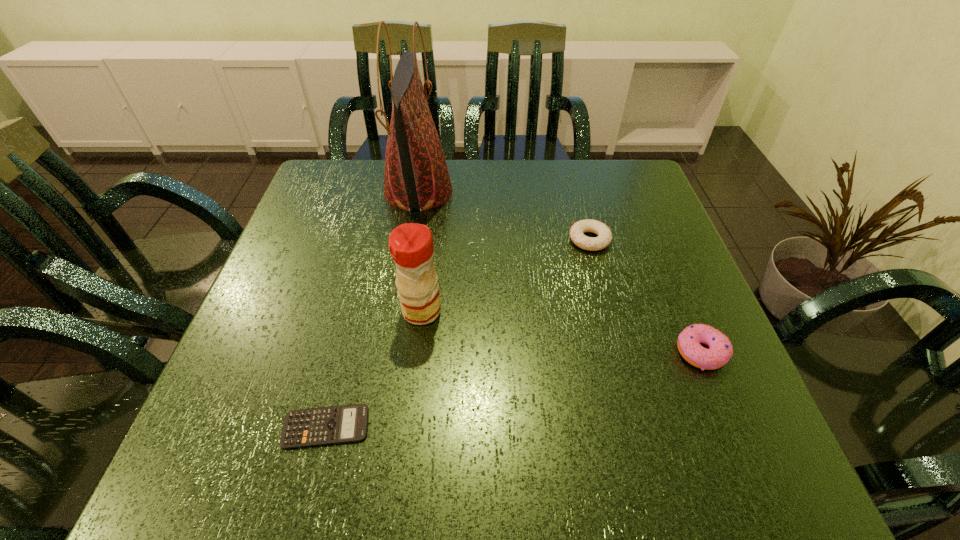
At what (x,y) coordinates should I click in order to perform the action: click on empty space that is in between the second object from right to left and the shortest object. Please return your answer as a coordinate pair (x, y). This screenshot has width=960, height=540. Looking at the image, I should click on (458, 333).

Where is `vacant area that lies between the second nearest object and the handbag`? The image size is (960, 540). vacant area that lies between the second nearest object and the handbag is located at coordinates (560, 272).

This screenshot has width=960, height=540. What are the coordinates of `vacant area between the second tallest object and the fourth tallest object` in the screenshot? It's located at (506, 275).

Locate an element on the screen. The height and width of the screenshot is (540, 960). object that is the third closest to the nearest object is located at coordinates (604, 238).

In order to click on object that stands as the closest to the condiment in this screenshot , I will do (x=348, y=423).

You are a GUI agent. You are given a task and a screenshot of the screen. Output one action in this format:
    pyautogui.click(x=<x>, y=<y>)
    Task: Click on the vacant area that satisfies the following two spatial constraints: 1. on the front side of the handbag; 2. on the right side of the condiment
    
    Given the screenshot: What is the action you would take?
    pyautogui.click(x=398, y=311)